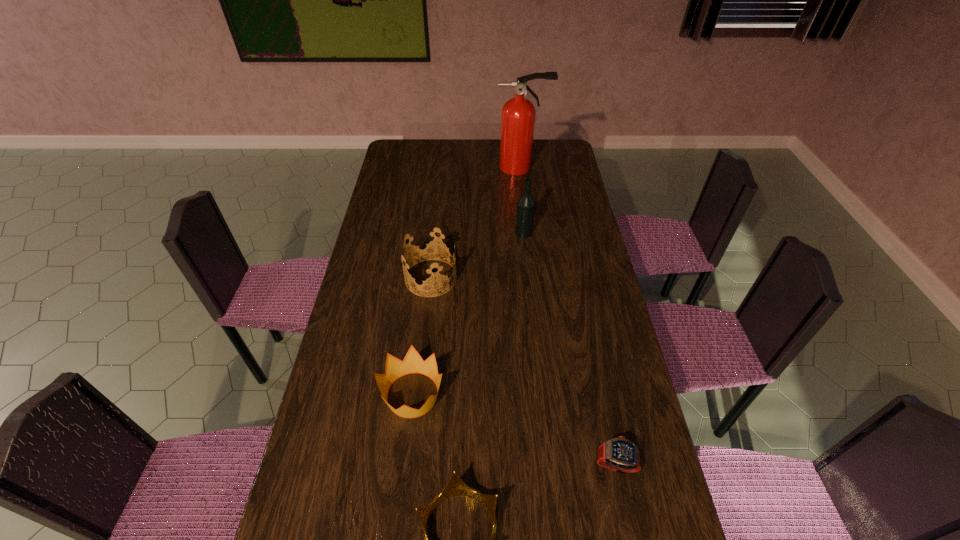
Identify which crown is located as the nearest to the nearest crown. Please provide its 2D coordinates. Your answer should be formatted as a tuple, i.e. [(x, y)], where the tuple contains the x and y coordinates of a point satisfying the conditions above.

[(412, 363)]

Find the location of a particular element. free space that satisfies the following two spatial constraints: 1. on the front side of the watch; 2. on the right side of the second nearest crown is located at coordinates (404, 463).

Find the location of a particular element. This screenshot has width=960, height=540. vacant space that satisfies the following two spatial constraints: 1. on the back side of the farthest object; 2. on the right side of the farthest crown is located at coordinates (443, 167).

I want to click on blank space that satisfies the following two spatial constraints: 1. on the back side of the fourth shortest object; 2. on the left side of the vodka, so click(x=436, y=233).